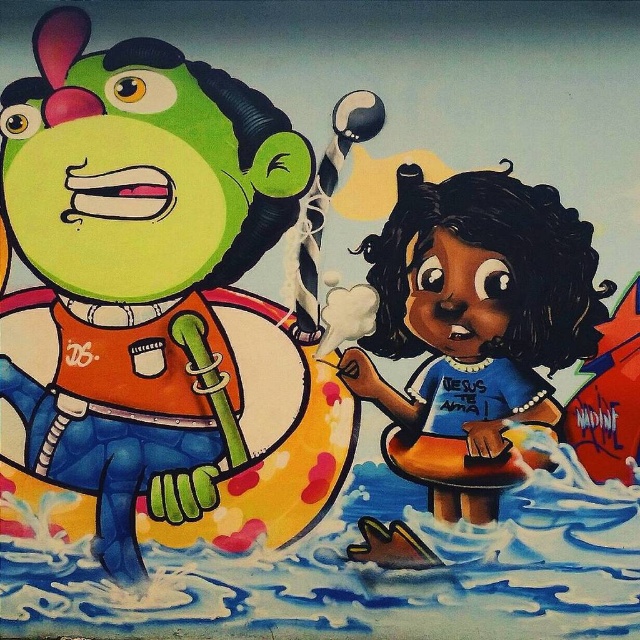
You are a mural painter who needs to place a new sticker between the green rubber alien at left and the smooth blue life preserver at center. The sticker requires a space that is at least as big as the smaller of the two objects. Which object determines the minimum space needed for the sticker?

The smooth blue life preserver at center is the smaller object, so the minimum space needed for the sticker is determined by its size.

You are a painter who needs to touch up the mural. You have a ladder that can reach up to 2 meters. The green rubber alien at left is positioned above the smooth blue life preserver at center. Can you reach both objects with your ladder?

The green rubber alien at left is above the smooth blue life preserver at center. Since the ladder can reach up to 2 meters, you can reach both objects if their heights are within this limit. However, the exact heights are not provided, so it depends on whether both are within the ladder reach.